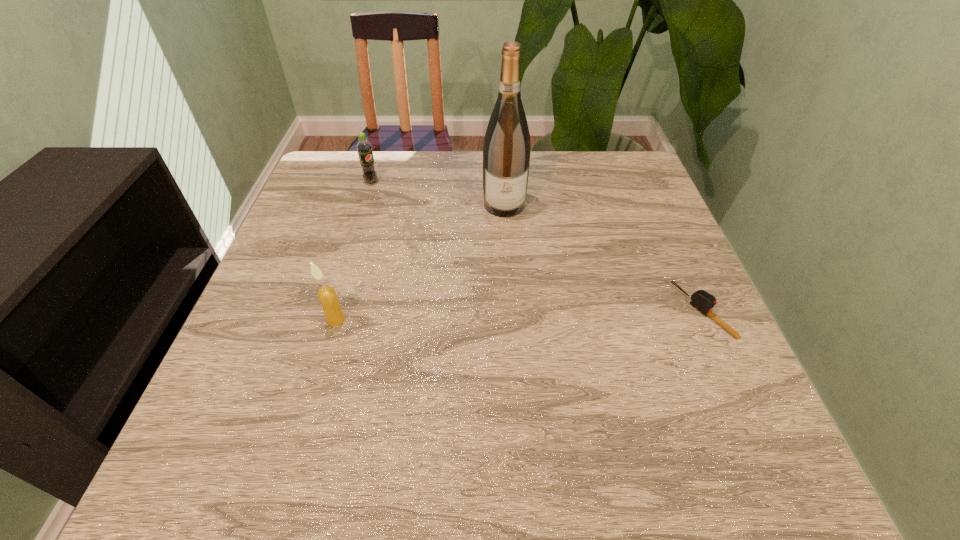
This screenshot has width=960, height=540. I want to click on free space located on the label of the tallest object, so click(x=516, y=339).

At what (x,y) coordinates should I click in order to perform the action: click on vacant region located on the label of the tallest object. Please return your answer as a coordinate pair (x, y). Looking at the image, I should click on (516, 339).

I want to click on free space located on the front label of the third tallest object, so click(x=450, y=239).

Where is `vacant region located on the front label of the third tallest object`? vacant region located on the front label of the third tallest object is located at coordinates (440, 232).

The image size is (960, 540). I want to click on vacant space situated 0.100m on the front label of the third tallest object, so click(397, 201).

Where is `wine bottle located at the far edge`? The height and width of the screenshot is (540, 960). wine bottle located at the far edge is located at coordinates (506, 152).

The height and width of the screenshot is (540, 960). What are the coordinates of `soda that is at the far edge` in the screenshot? It's located at (364, 148).

Locate an element on the screen. The height and width of the screenshot is (540, 960). candle located in the left edge section of the desktop is located at coordinates (328, 298).

Locate an element on the screen. The height and width of the screenshot is (540, 960). soda positioned at the left edge is located at coordinates (364, 148).

Locate an element on the screen. This screenshot has height=540, width=960. object positioned at the right edge is located at coordinates (703, 301).